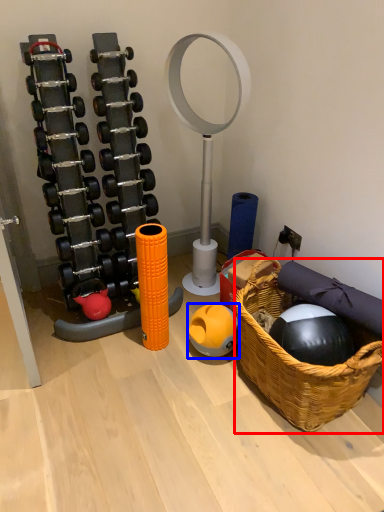
Question: Among these objects, which one is farthest to the camera, basket (highlighted by a red box) or ball (highlighted by a blue box)?

Choices:
 (A) basket
 (B) ball

Answer: (B)